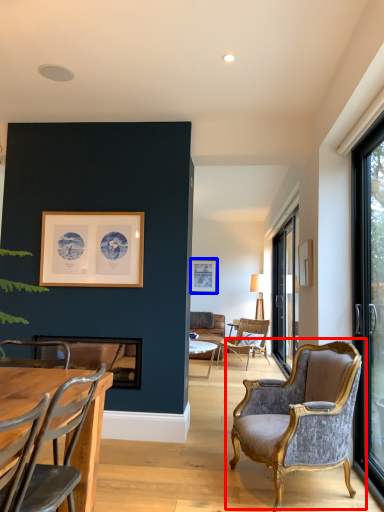
Question: Among these objects, which one is farthest to the camera, chair (highlighted by a red box) or picture frame (highlighted by a blue box)?

Choices:
 (A) chair
 (B) picture frame

Answer: (B)